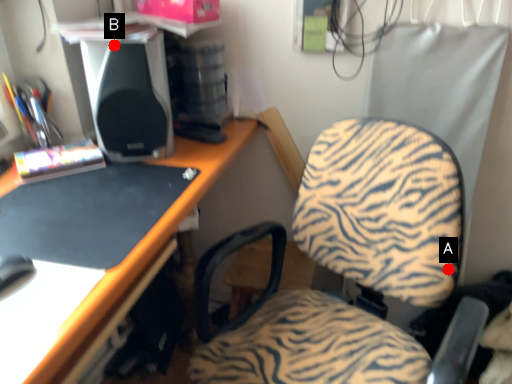
Question: Two points are circled on the image, labeled by A and B beside each circle. Which point appears closest to the camera in this image?

Choices:
 (A) A is closer
 (B) B is closer

Answer: (A)